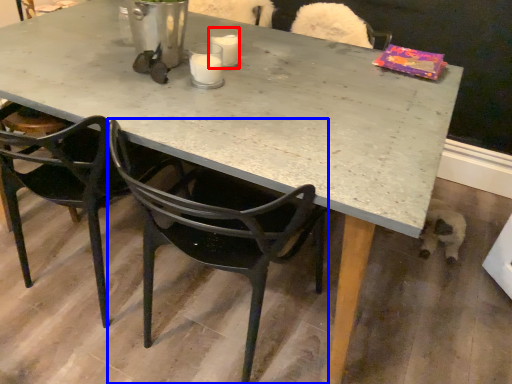
Question: Which object is closer to the camera taking this photo, coffee cup (highlighted by a red box) or chair (highlighted by a blue box)?

Choices:
 (A) coffee cup
 (B) chair

Answer: (B)